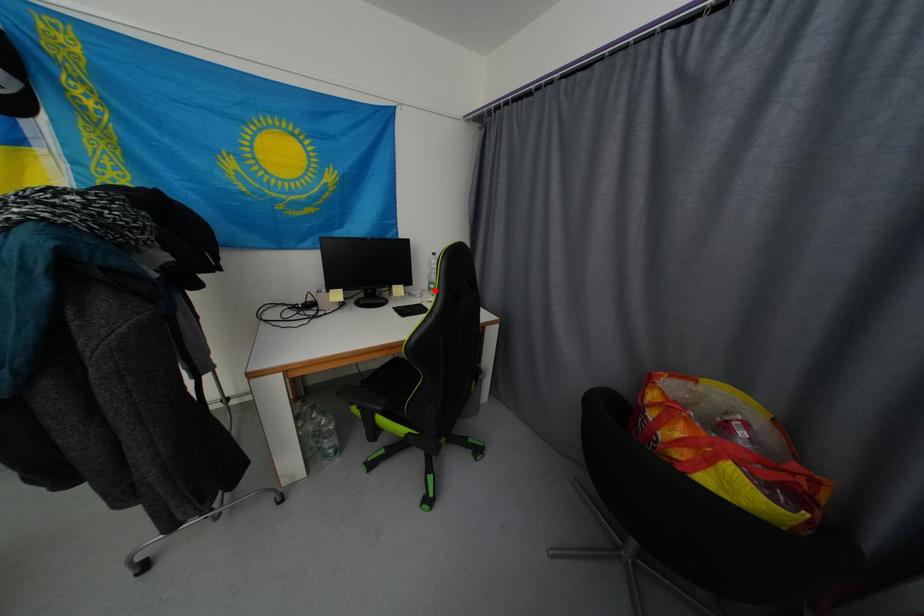
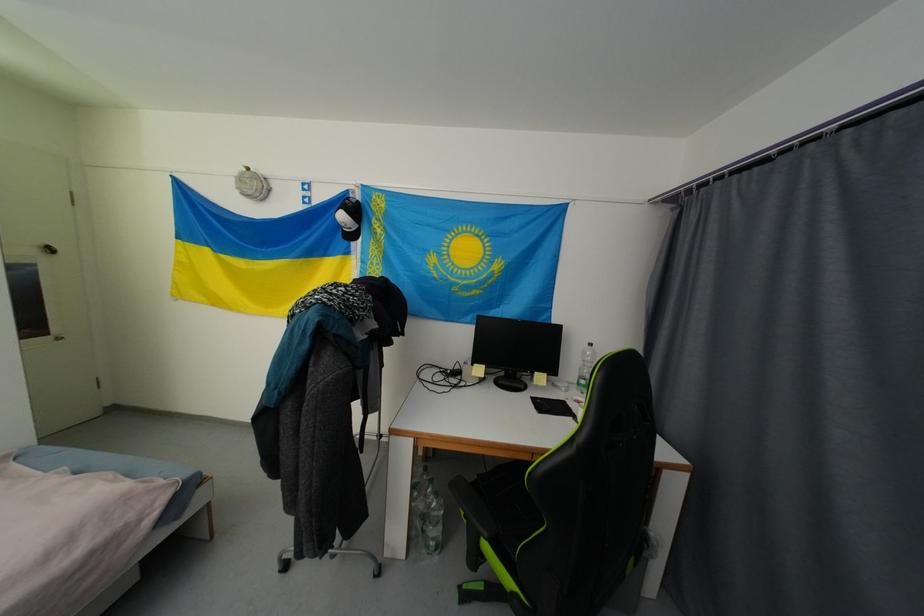
Find the pixel in the second image that matches the highlighted location in the first image.

(584, 386)